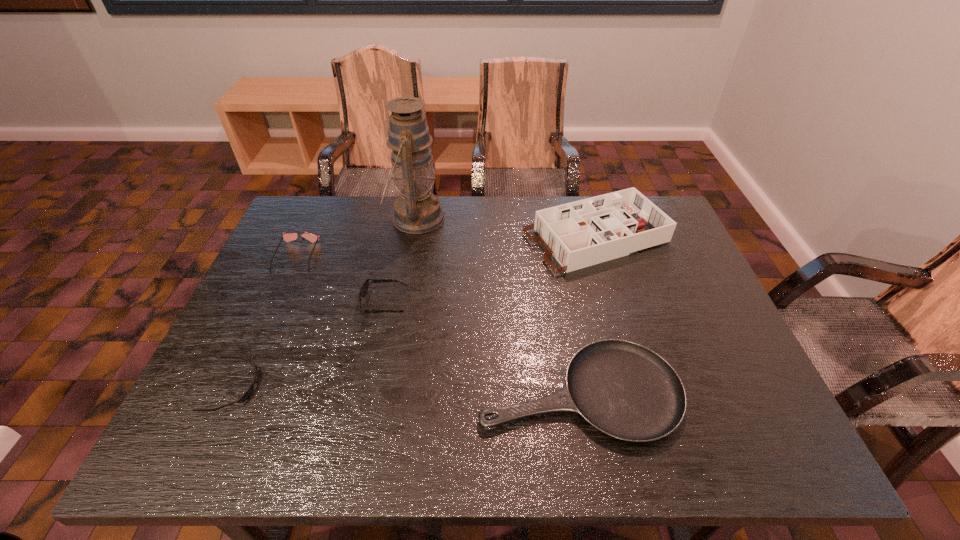
At what (x,y) coordinates should I click in order to perform the action: click on free region that satisfies the following two spatial constraints: 1. on the front-facing side of the rightmost sunglasses; 2. on the left side of the frying pan. Please return your answer as a coordinate pair (x, y). The height and width of the screenshot is (540, 960). Looking at the image, I should click on click(366, 392).

Locate an element on the screen. The width and height of the screenshot is (960, 540). free space that satisfies the following two spatial constraints: 1. on the front side of the fifth shortest object; 2. on the front-facing side of the shortest sunglasses is located at coordinates (640, 387).

At what (x,y) coordinates should I click in order to perform the action: click on blank area in the image that satisfies the following two spatial constraints: 1. on the front-facing side of the third nearest object; 2. on the left side of the frying pan. Please return your answer as a coordinate pair (x, y). The width and height of the screenshot is (960, 540). Looking at the image, I should click on pos(366,392).